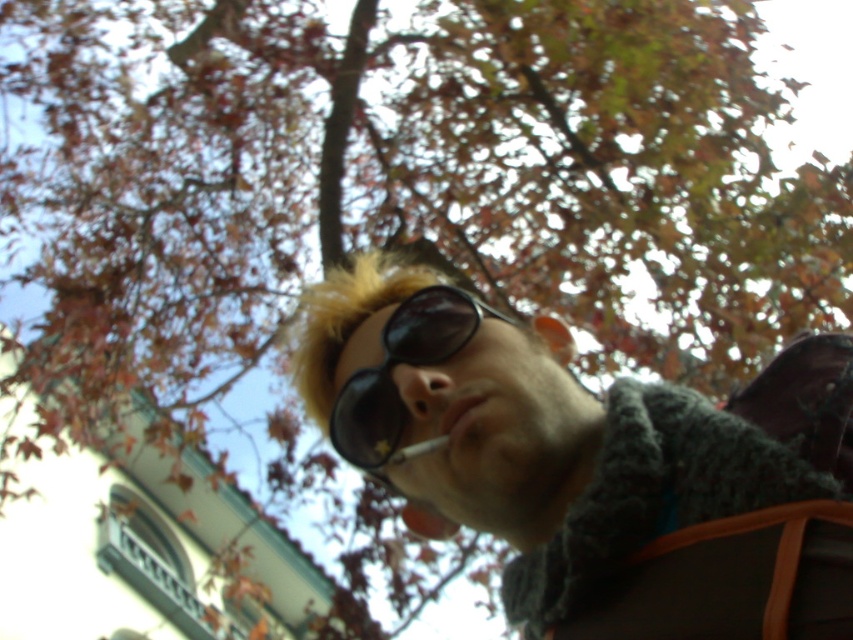
Who is taller, matte black sunglasses at center or white matte cigarette at center?

Standing taller between the two is matte black sunglasses at center.

Is point (453, 314) farther from viewer compared to point (405, 449)?

Yes, point (453, 314) is behind point (405, 449).

Who is more distant from viewer, [630,545] or [447,440]?

Positioned behind is point [447,440].

Find the location of a particular element. matte black sunglasses at center is located at coordinates (521, 433).

Is matte black sunglasses at center shorter than black matte sunglasses at center?

In fact, matte black sunglasses at center may be taller than black matte sunglasses at center.

Between matte black sunglasses at center and black matte sunglasses at center, which one is positioned higher?

black matte sunglasses at center is above.

Consider the image. Who is more forward, (553, 476) or (409, 346)?

Point (553, 476) is more forward.

You are a GUI agent. You are given a task and a screenshot of the screen. Output one action in this format:
    pyautogui.click(x=<x>, y=<y>)
    Task: Click on the matte black sunglasses at center
    
    Given the screenshot: What is the action you would take?
    pyautogui.click(x=521, y=433)

Can you confirm if black matte sunglasses at center is thinner than white matte cigarette at center?

Incorrect, black matte sunglasses at center's width is not less than white matte cigarette at center's.

Can you confirm if black matte sunglasses at center is taller than white matte cigarette at center?

Correct, black matte sunglasses at center is much taller as white matte cigarette at center.

Locate an element on the screen. This screenshot has height=640, width=853. black matte sunglasses at center is located at coordinates (398, 364).

Find the location of a particular element. black matte sunglasses at center is located at coordinates [398, 364].